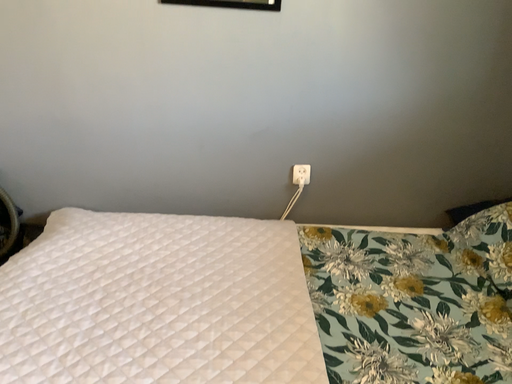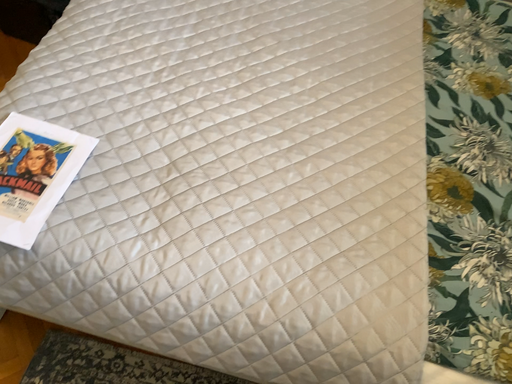
Question: Which way did the camera rotate in the video?

Choices:
 (A) rotated upward
 (B) rotated downward

Answer: (B)